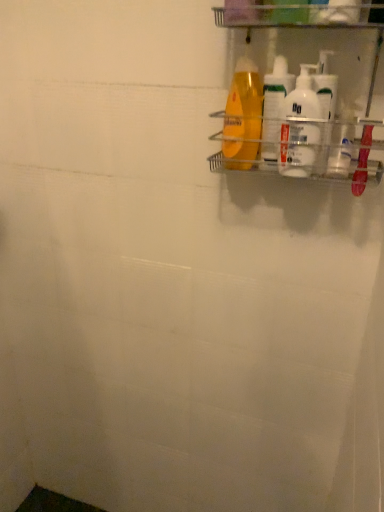
The image size is (384, 512). What do you see at coordinates (326, 85) in the screenshot? I see `white plastic bottles at upper right, which is the 4th cleaning product from left to right` at bounding box center [326, 85].

You are a GUI agent. You are given a task and a screenshot of the screen. Output one action in this format:
    pyautogui.click(x=<x>, y=<y>)
    Task: Click on the white glossy bottles at upper right, the 2th cleaning product from the right
    The height and width of the screenshot is (512, 384).
    Given the screenshot: What is the action you would take?
    pyautogui.click(x=300, y=127)

Is translucent plastic bottle at upper right, the second cleaning product positioned from the left, with translucent plastic shampoo bottle at upper right, which is the first cleaning product from left to right?

Yes, translucent plastic bottle at upper right, the second cleaning product positioned from the left, is with translucent plastic shampoo bottle at upper right, which is the first cleaning product from left to right.

Is translucent plastic bottle at upper right, the second cleaning product positioned from the left, situated inside translucent plastic shampoo bottle at upper right, which is the first cleaning product from left to right, or outside?

The correct answer is: outside.

I want to click on the 2nd cleaning product in front of the translucent plastic bottle at upper right, which is the third cleaning product from right to left, so click(x=243, y=117).

Does translucent plastic bottle at upper right, the second cleaning product positioned from the left, appear on the right side of translucent plastic shampoo bottle at upper right, which is the first cleaning product from left to right?

Yes.

Is translucent plastic shampoo bottle at upper right, which is the first cleaning product from left to right, behind translucent plastic bottle at upper right, the second cleaning product positioned from the left?

That is False.

Is translucent plastic shampoo bottle at upper right, marked as the fourth cleaning product in a right-to-left arrangement, oriented towards translucent plastic bottle at upper right, the second cleaning product positioned from the left?

Yes, translucent plastic shampoo bottle at upper right, marked as the fourth cleaning product in a right-to-left arrangement, is turned towards translucent plastic bottle at upper right, the second cleaning product positioned from the left.

In the scene shown: Between translucent plastic shampoo bottle at upper right, which is the first cleaning product from left to right, and translucent plastic bottle at upper right, which is the third cleaning product from right to left, which one appears on the left side from the viewer's perspective?

translucent plastic shampoo bottle at upper right, which is the first cleaning product from left to right.

Considering the relative sizes of translucent plastic shampoo bottle at upper right, which is the first cleaning product from left to right, and translucent plastic bottle at upper right, which is the third cleaning product from right to left, in the image provided, is translucent plastic shampoo bottle at upper right, which is the first cleaning product from left to right, smaller than translucent plastic bottle at upper right, which is the third cleaning product from right to left,?

No.

Between translucent plastic shampoo bottle at upper right, which is the first cleaning product from left to right, and clear plastic bottle at upper right, which one has more height?

Standing taller between the two is translucent plastic shampoo bottle at upper right, which is the first cleaning product from left to right.

Is translucent plastic shampoo bottle at upper right, which is the first cleaning product from left to right, not within clear plastic bottle at upper right?

translucent plastic shampoo bottle at upper right, which is the first cleaning product from left to right, is positioned outside clear plastic bottle at upper right.

Is translucent plastic shampoo bottle at upper right, which is the first cleaning product from left to right, far away from clear plastic bottle at upper right?

translucent plastic shampoo bottle at upper right, which is the first cleaning product from left to right, is near clear plastic bottle at upper right, not far away.

Can you tell me how much translucent plastic shampoo bottle at upper right, marked as the fourth cleaning product in a right-to-left arrangement, and clear plastic bottle at upper right differ in facing direction?

The angle between the facing direction of translucent plastic shampoo bottle at upper right, marked as the fourth cleaning product in a right-to-left arrangement, and the facing direction of clear plastic bottle at upper right is 45 degrees.

Does white plastic bottles at upper right, which is the 4th cleaning product from left to right, appear on the left side of clear plastic bottle at upper right?

Correct, you'll find white plastic bottles at upper right, which is the 4th cleaning product from left to right, to the left of clear plastic bottle at upper right.

Considering the sizes of objects white plastic bottles at upper right, which is the 4th cleaning product from left to right, and clear plastic bottle at upper right in the image provided, who is shorter, white plastic bottles at upper right, which is the 4th cleaning product from left to right, or clear plastic bottle at upper right?

Standing shorter between the two is clear plastic bottle at upper right.

Is there a large distance between white plastic bottles at upper right, which is the 4th cleaning product from left to right, and clear plastic bottle at upper right?

No.

Which of these two, white plastic bottles at upper right, which is the 4th cleaning product from left to right, or clear plastic bottle at upper right, is bigger?

With larger size is white plastic bottles at upper right, which is the 4th cleaning product from left to right.

From the picture: Does white glossy bottles at upper right, the 2th cleaning product from the right, come behind clear plastic bottle at upper right?

That is False.

From the image's perspective, relative to clear plastic bottle at upper right, is white glossy bottles at upper right, the 2th cleaning product from the right, above or below?

Clearly, from the image's perspective, white glossy bottles at upper right, the 2th cleaning product from the right, is above clear plastic bottle at upper right.

Is white glossy bottles at upper right, placed as the third cleaning product when sorted from left to right, wider or thinner than clear plastic bottle at upper right?

In the image, white glossy bottles at upper right, placed as the third cleaning product when sorted from left to right, appears to be more narrow than clear plastic bottle at upper right.

Who is taller, white glossy bottles at upper right, placed as the third cleaning product when sorted from left to right, or clear plastic bottle at upper right?

white glossy bottles at upper right, placed as the third cleaning product when sorted from left to right, is taller.

Is clear plastic shelf at upper right to the left of white plastic bottles at upper right, which is the 4th cleaning product from left to right, from the viewer's perspective?

Indeed, clear plastic shelf at upper right is positioned on the left side of white plastic bottles at upper right, which is the 4th cleaning product from left to right.

Considering the sizes of objects clear plastic shelf at upper right and white plastic bottles at upper right, which is the 4th cleaning product from left to right, in the image provided, who is thinner, clear plastic shelf at upper right or white plastic bottles at upper right, which is the 4th cleaning product from left to right,?

white plastic bottles at upper right, which is the 4th cleaning product from left to right.

From a real-world perspective, which object rests below the other?

From a 3D spatial view, white plastic bottles at upper right, which is the 4th cleaning product from left to right, is below.

Considering the relative positions of white glossy bottles at upper right, the 2th cleaning product from the right, and translucent plastic bottle at upper right, the second cleaning product positioned from the left, in the image provided, is white glossy bottles at upper right, the 2th cleaning product from the right, to the right of translucent plastic bottle at upper right, the second cleaning product positioned from the left, from the viewer's perspective?

Yes.

Can you confirm if white glossy bottles at upper right, placed as the third cleaning product when sorted from left to right, is wider than translucent plastic bottle at upper right, the second cleaning product positioned from the left?

Incorrect, the width of white glossy bottles at upper right, placed as the third cleaning product when sorted from left to right, does not surpass that of translucent plastic bottle at upper right, the second cleaning product positioned from the left.

Relative to translucent plastic bottle at upper right, the second cleaning product positioned from the left, is white glossy bottles at upper right, the 2th cleaning product from the right, in front or behind?

white glossy bottles at upper right, the 2th cleaning product from the right, is in front of translucent plastic bottle at upper right, the second cleaning product positioned from the left.

Does point (304, 71) lie in front of point (276, 131)?

Yes, it is in front of point (276, 131).

Locate an element on the screen. cleaning product on the left of the translucent plastic bottle at upper right, which is the third cleaning product from right to left is located at coordinates pyautogui.click(x=243, y=117).

From the translucent plastic shampoo bottle at upper right, marked as the fourth cleaning product in a right-to-left arrangement, count 1st cleaning product to the right and point to it. Please provide its 2D coordinates.

[(274, 105)]

Looking at the image, which one is located closer to clear plastic bottle at upper right, translucent plastic shampoo bottle at upper right, which is the first cleaning product from left to right, or translucent plastic bottle at upper right, which is the third cleaning product from right to left?

The object closer to clear plastic bottle at upper right is translucent plastic bottle at upper right, which is the third cleaning product from right to left.

Based on their spatial positions, is clear plastic shelf at upper right or translucent plastic shampoo bottle at upper right, marked as the fourth cleaning product in a right-to-left arrangement, closer to translucent plastic bottle at upper right, the second cleaning product positioned from the left?

Based on the image, translucent plastic shampoo bottle at upper right, marked as the fourth cleaning product in a right-to-left arrangement, appears to be nearer to translucent plastic bottle at upper right, the second cleaning product positioned from the left.

Which object lies further to the anchor point clear plastic bottle at upper right, white glossy bottles at upper right, placed as the third cleaning product when sorted from left to right, or translucent plastic bottle at upper right, which is the third cleaning product from right to left?

translucent plastic bottle at upper right, which is the third cleaning product from right to left, is positioned further to the anchor clear plastic bottle at upper right.

Estimate the real-world distances between objects in this image. Which object is closer to white glossy bottles at upper right, the 2th cleaning product from the right, translucent plastic bottle at upper right, the second cleaning product positioned from the left, or clear plastic bottle at upper right?

translucent plastic bottle at upper right, the second cleaning product positioned from the left, is closer to white glossy bottles at upper right, the 2th cleaning product from the right.

Considering their positions, is white glossy bottles at upper right, placed as the third cleaning product when sorted from left to right, positioned closer to clear plastic shelf at upper right than translucent plastic shampoo bottle at upper right, which is the first cleaning product from left to right?

white glossy bottles at upper right, placed as the third cleaning product when sorted from left to right, is positioned closer to the anchor clear plastic shelf at upper right.

Estimate the real-world distances between objects in this image. Which object is closer to white glossy bottles at upper right, placed as the third cleaning product when sorted from left to right, translucent plastic shampoo bottle at upper right, marked as the fourth cleaning product in a right-to-left arrangement, or clear plastic bottle at upper right?

The object closer to white glossy bottles at upper right, placed as the third cleaning product when sorted from left to right, is clear plastic bottle at upper right.

Looking at the image, which one is located closer to translucent plastic bottle at upper right, which is the third cleaning product from right to left, translucent plastic shampoo bottle at upper right, marked as the fourth cleaning product in a right-to-left arrangement, or clear plastic bottle at upper right?

Among the two, translucent plastic shampoo bottle at upper right, marked as the fourth cleaning product in a right-to-left arrangement, is located nearer to translucent plastic bottle at upper right, which is the third cleaning product from right to left.

When comparing their distances from clear plastic bottle at upper right, does white plastic bottles at upper right, which is the 4th cleaning product from left to right, or clear plastic shelf at upper right seem further?

The object further to clear plastic bottle at upper right is clear plastic shelf at upper right.

Locate an element on the screen. cleaning product situated between translucent plastic shampoo bottle at upper right, marked as the fourth cleaning product in a right-to-left arrangement, and white glossy bottles at upper right, the 2th cleaning product from the right, from left to right is located at coordinates (274, 105).

The height and width of the screenshot is (512, 384). I want to click on cleaning product positioned between clear plastic shelf at upper right and translucent plastic shampoo bottle at upper right, marked as the fourth cleaning product in a right-to-left arrangement, from near to far, so click(300, 127).

Where is `cleaning product situated between white glossy bottles at upper right, placed as the third cleaning product when sorted from left to right, and clear plastic bottle at upper right from left to right`? The width and height of the screenshot is (384, 512). cleaning product situated between white glossy bottles at upper right, placed as the third cleaning product when sorted from left to right, and clear plastic bottle at upper right from left to right is located at coordinates (326, 85).

Locate an element on the screen. shelf located between translucent plastic shampoo bottle at upper right, which is the first cleaning product from left to right, and white plastic bottles at upper right, which is the 1th cleaning product in right-to-left order, in the left-right direction is located at coordinates (294, 99).